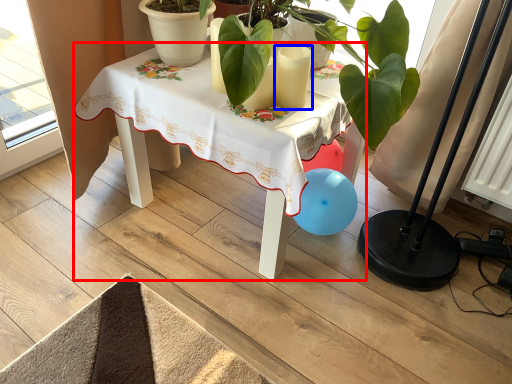
Question: Which point is further to the camera, table (highlighted by a red box) or candle (highlighted by a blue box)?

Choices:
 (A) table
 (B) candle

Answer: (B)